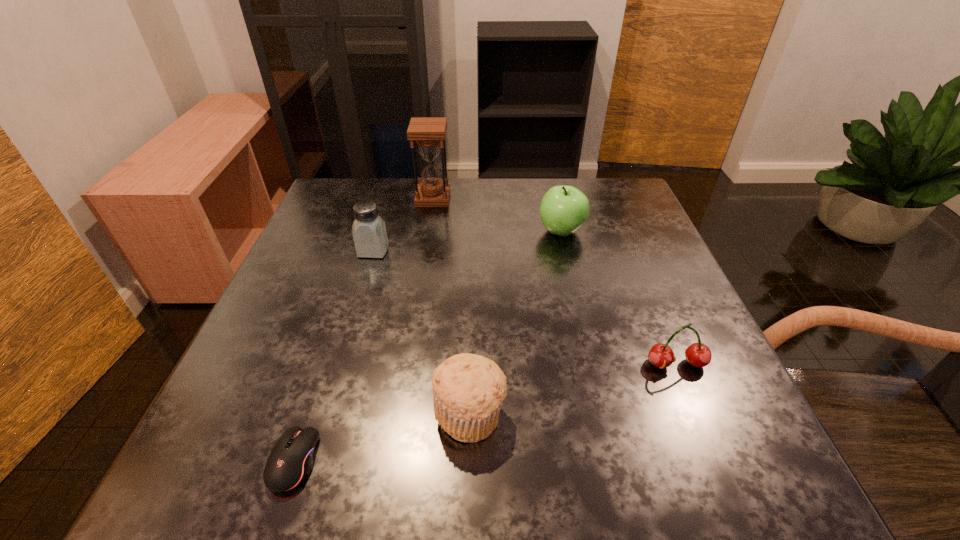
Find the location of a particular element. This screenshot has height=540, width=960. object identified as the closest to the computer mouse is located at coordinates (468, 390).

The width and height of the screenshot is (960, 540). What are the coordinates of `free space in the image that satisfies the following two spatial constraints: 1. on the back side of the second object from right to left; 2. on the left side of the shortest object` in the screenshot? It's located at (369, 231).

You are a GUI agent. You are given a task and a screenshot of the screen. Output one action in this format:
    pyautogui.click(x=<x>, y=<y>)
    Task: Click on the free space that satisfies the following two spatial constraints: 1. on the back side of the computer mouse; 2. on the right side of the farthest object
    This screenshot has width=960, height=540.
    Given the screenshot: What is the action you would take?
    pyautogui.click(x=379, y=199)

Image resolution: width=960 pixels, height=540 pixels. Identify the location of vacant point that satisfies the following two spatial constraints: 1. on the front side of the second object from right to left; 2. on the left side of the farthest object. (428, 231).

Where is `vacant space that satisfies the following two spatial constraints: 1. on the back side of the computer mouse; 2. on the left side of the third object from left to right`? This screenshot has width=960, height=540. vacant space that satisfies the following two spatial constraints: 1. on the back side of the computer mouse; 2. on the left side of the third object from left to right is located at coordinates (379, 199).